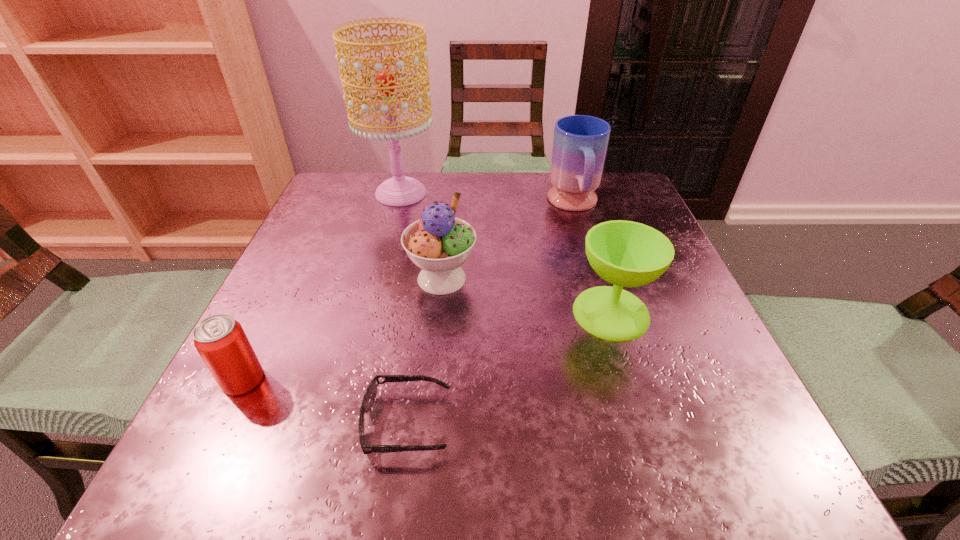
Identify the location of object present at the far left corner. This screenshot has width=960, height=540. (400, 190).

The image size is (960, 540). In order to click on object that is at the far right corner in this screenshot , I will do `click(580, 142)`.

Where is `vacant space at the far edge of the desktop`? vacant space at the far edge of the desktop is located at coordinates (530, 183).

Where is `vacant space at the left edge of the desktop`? vacant space at the left edge of the desktop is located at coordinates (337, 293).

The height and width of the screenshot is (540, 960). I want to click on vacant space at the right edge, so click(x=690, y=350).

Identify the location of vacant space at the far left corner of the desktop. (x=370, y=183).

Identify the location of blank area at the near left corner. This screenshot has width=960, height=540. (227, 430).

Identify the location of free location at the far right corner. click(x=632, y=179).

Image resolution: width=960 pixels, height=540 pixels. In the image, there is a desktop. What are the coordinates of `vacant space at the near right corner` in the screenshot? It's located at (707, 470).

You are a GUI agent. You are given a task and a screenshot of the screen. Output one action in this format:
    pyautogui.click(x=<x>, y=<y>)
    Task: Click on the vacant point located between the sunglasses and the wineglass
    The image size is (960, 540).
    Given the screenshot: What is the action you would take?
    pyautogui.click(x=509, y=368)